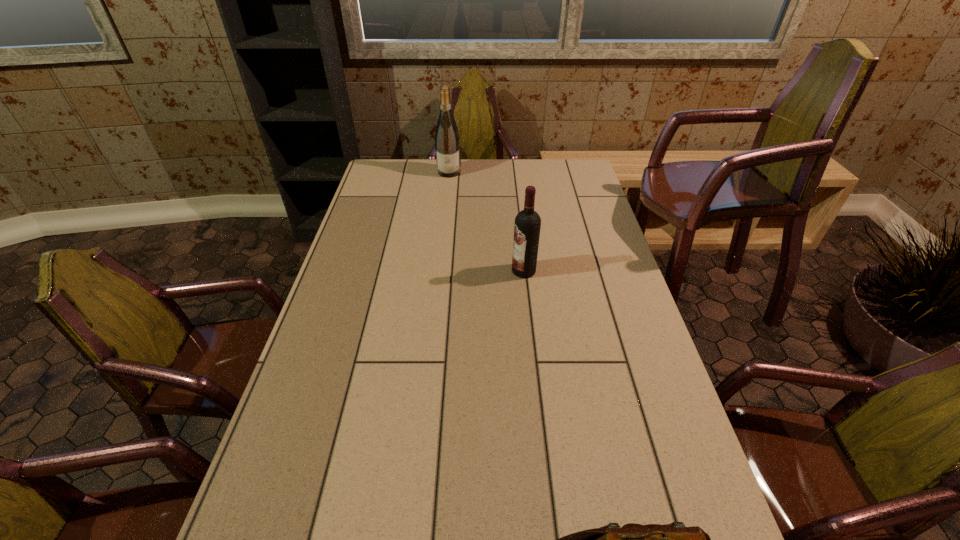
Identify the location of the second closest object to the farthest object. (674, 539).